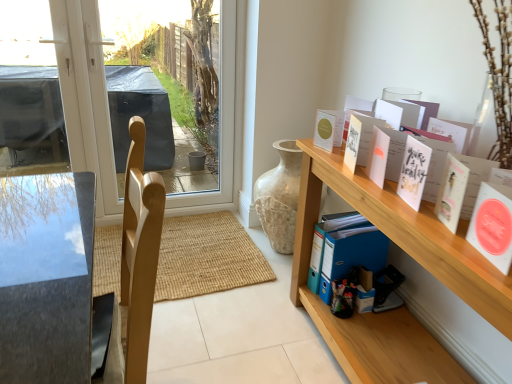
Locate an element on the screen. free space in front of matte white card at upper right, which is the 1th book from back to front is located at coordinates (334, 158).